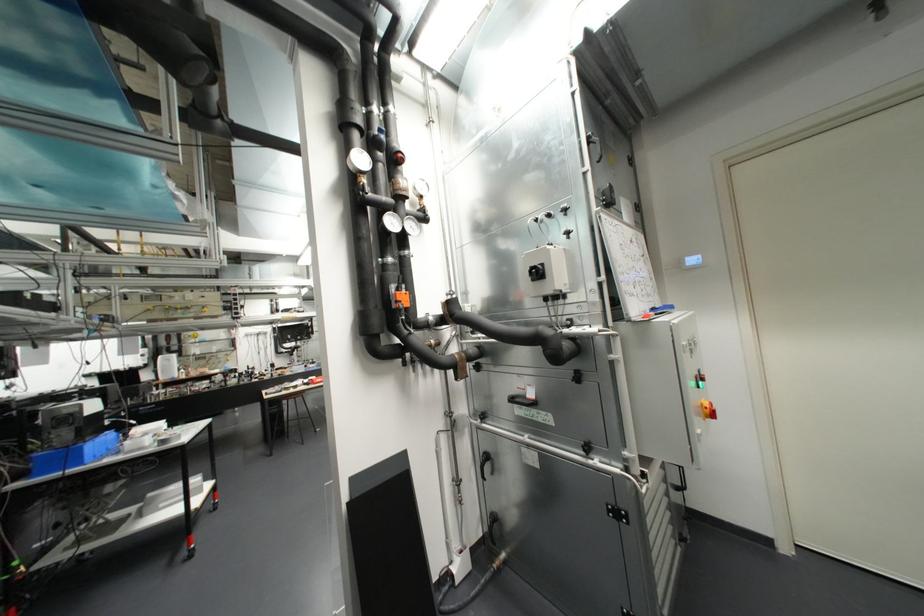
The width and height of the screenshot is (924, 616). Describe the element at coordinates (536, 272) in the screenshot. I see `the black rotary switch` at that location.